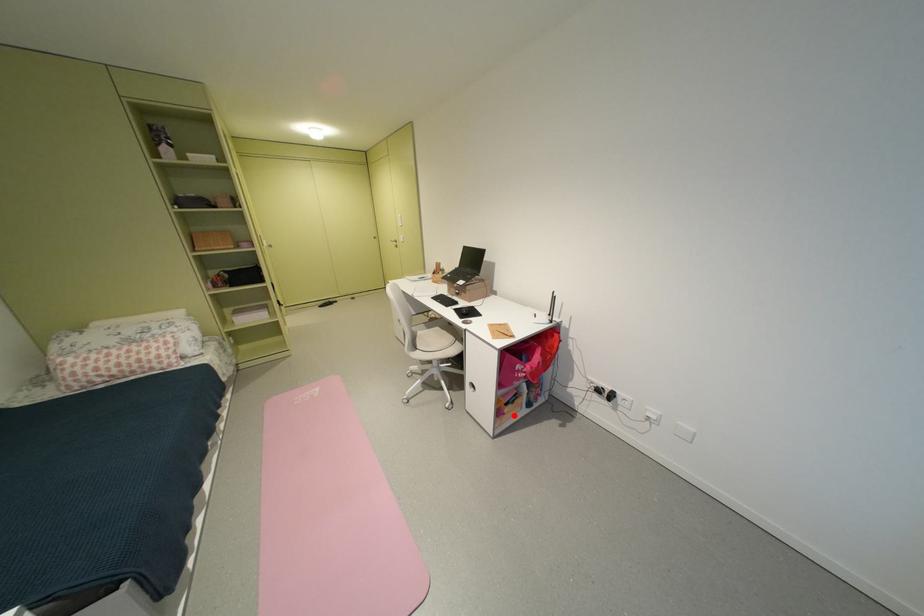
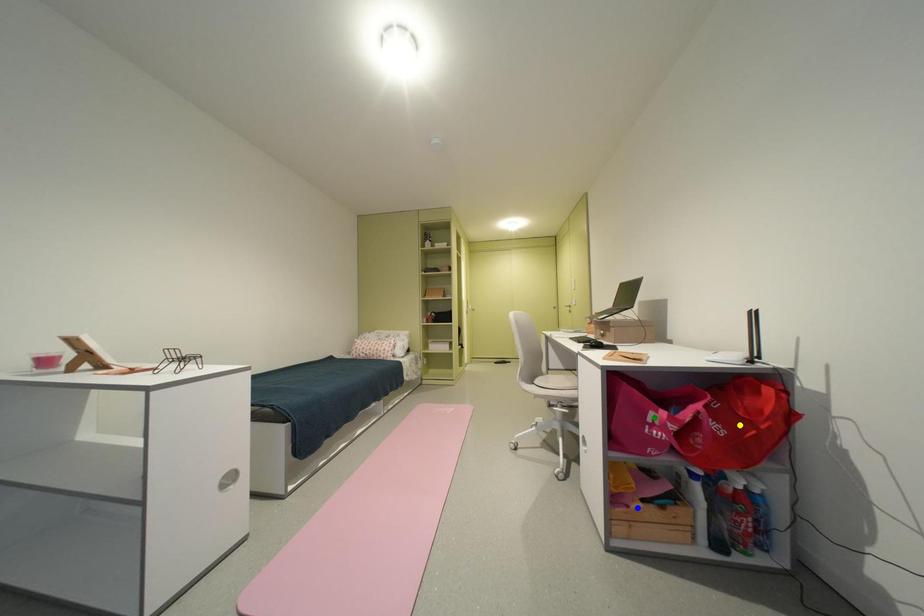
Question: I am providing you with two images of the same scene from different viewpoints. A red point is marked on the first image. You are given multiple points on the second image. Can you choose the point in image 2 that corresponds to the point in image 1?

Choices:
 (A) yellow point
 (B) green point
 (C) blue point

Answer: (C)